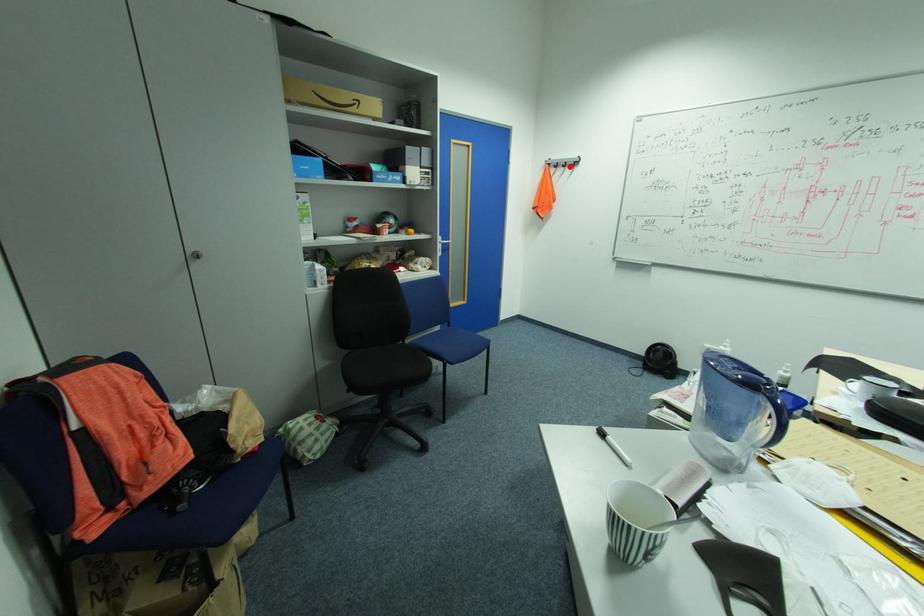
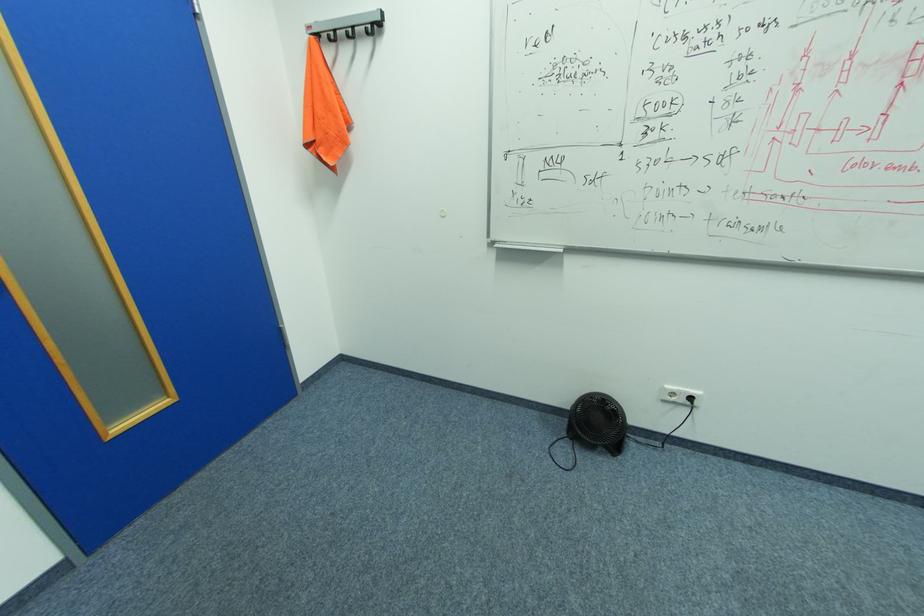
The point at the highlighted location is marked in the first image. Where is the corresponding point in the second image?

(355, 34)